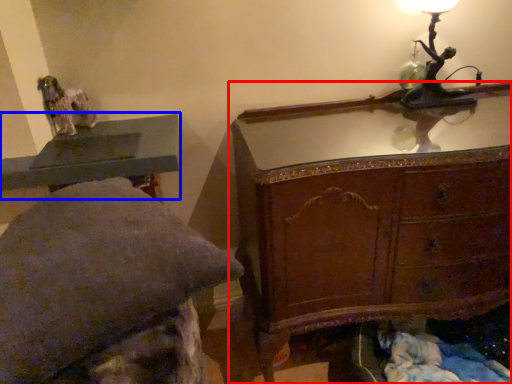
Question: Which object is further to the camera taking this photo, chest of drawers (highlighted by a red box) or table (highlighted by a blue box)?

Choices:
 (A) chest of drawers
 (B) table

Answer: (B)